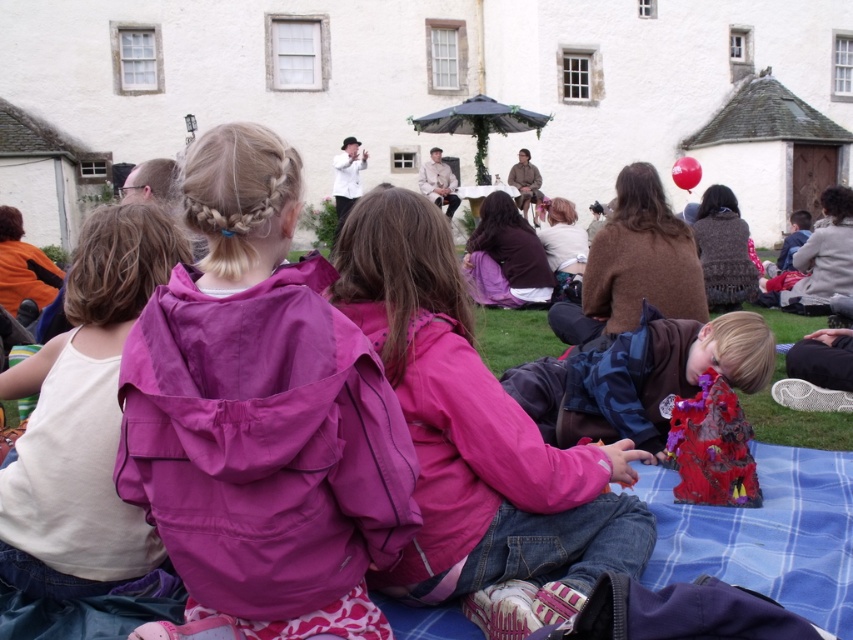
You are organizing a costume party and need to decide which fabric to use for a flowing dress. The white fabric shirt at left and the dark blue fabric at lower right are available. Based on their thickness, which fabric would allow for better movement and fluidity?

The white fabric shirt at left is thinner than the dark blue fabric at lower right, so it would allow for better movement and fluidity in a flowing dress.

You are a photographer standing at the back of the gathering. You want to take a photo that includes both the purple fabric jacket at center and the pink fabric jacket at center. Which jacket will appear larger in your photo?

The purple fabric jacket at center will appear larger in the photo because it is closer to the viewer than the pink fabric jacket at center.